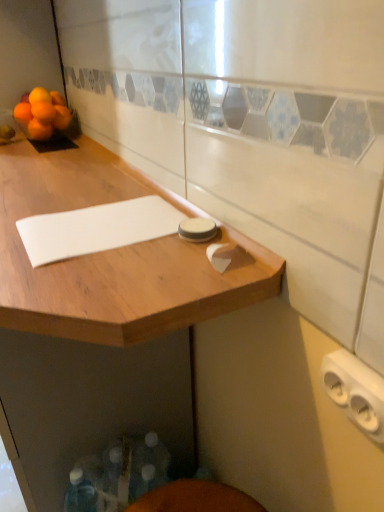
Question: Based on their positions, is white plastic outlet at lower right located to the left or right of orange matte at upper left, the 4th orange in the left-to-right sequence?

Choices:
 (A) left
 (B) right

Answer: (B)

Question: In terms of height, does white plastic outlet at lower right look taller or shorter compared to orange matte at upper left, which ranks as the first orange in right-to-left order?

Choices:
 (A) short
 (B) tall

Answer: (A)

Question: Based on their relative distances, which object is farther from the orange matte at left, positioned as the first orange in left-to-right order?

Choices:
 (A) orange matte tangerine at upper left
 (B) white matte notepad at center
 (C) orange matte at upper left, positioned as the second orange in left-to-right order
 (D) orange matte at upper left, which is counted as the 3th orange, starting from the left
 (E) orange matte at upper left, which ranks as the first orange in right-to-left order

Answer: (B)

Question: Considering the real-world distances, which object is closest to the orange matte at left, arranged as the fourth orange when viewed from the right?

Choices:
 (A) orange matte at upper left, which ranks as the first orange in right-to-left order
 (B) orange matte at upper left, which is the second orange in right-to-left order
 (C) white matte notepad at center
 (D) orange matte tangerine at upper left
 (E) orange matte at upper left, positioned as the second orange in left-to-right order

Answer: (A)